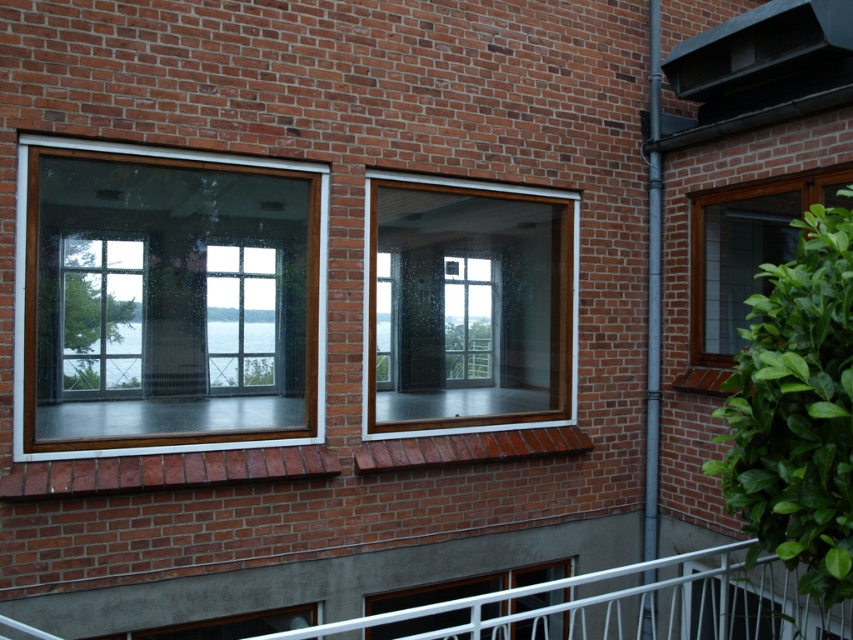
You are standing in front of the brick building and want to enter through the clear glass window at lower center. However, there is a security guard standing to your left. To avoid being noticed, you decide to approach the matte brown window at right instead. Which window should you approach to stay out of the guard s line of sight?

You should approach the matte brown window at right because it is positioned to the right of the clear glass window at lower center, placing it further away from the security guard who is on your left.

From the picture: You are an architect designing a new building and want to ensure that the windows allow for maximum natural light. Given the scene described, which window between the matte brown window at right and the clear glass window at lower center would you choose for better light transmission?

The clear glass window at lower center would be better for maximum natural light as it is clear glass, unlike the matte brown window at right which has a darker and more opaque finish.